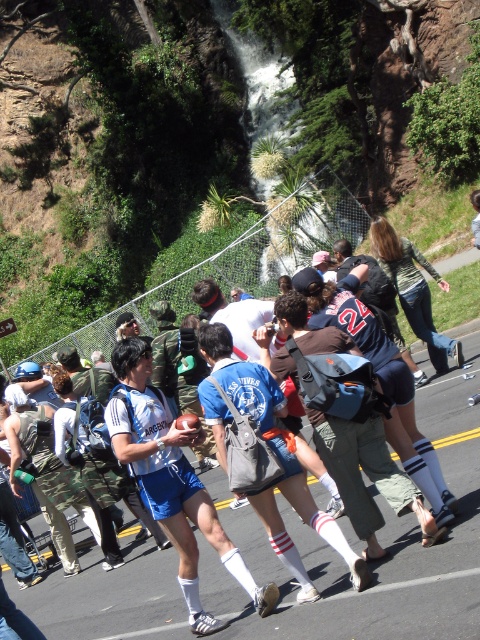
Question: Which of the following is the farthest from the observer?

Choices:
 (A) (445, 582)
 (B) (369, 266)

Answer: (B)

Question: Which point is farther to the camera?

Choices:
 (A) dark blue jersey at center
 (B) white fabric shorts at center

Answer: (A)

Question: Which of the following is the closest to the observer?

Choices:
 (A) white fabric shorts at center
 (B) dark blue jersey at center

Answer: (A)

Question: Does white fabric shorts at center appear on the right side of dark blue jersey at center?

Choices:
 (A) no
 (B) yes

Answer: (A)

Question: Can you confirm if white fabric shorts at center is thinner than dark blue jersey at center?

Choices:
 (A) yes
 (B) no

Answer: (B)

Question: Is white fabric shorts at center below dark blue jersey at center?

Choices:
 (A) yes
 (B) no

Answer: (A)